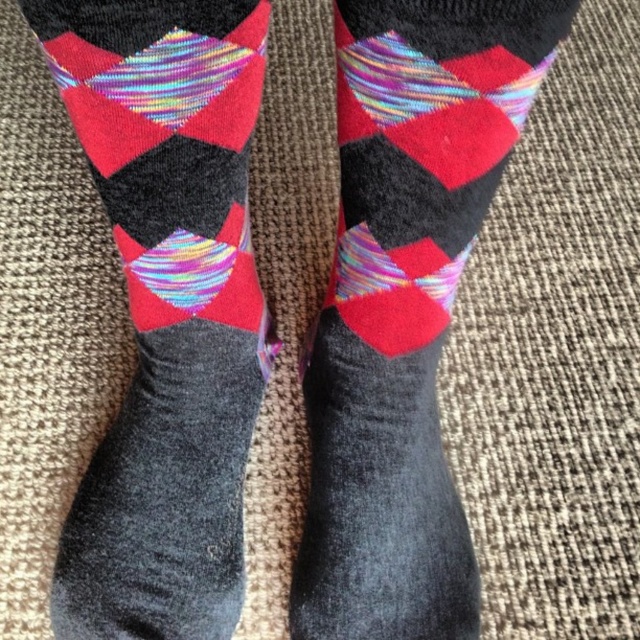
You are a photographer trying to capture the socks in the image. You want to focus on the point that is closer to the camera. Which point should you choose between point (266, 12) and point (433, 129)?

Point (433, 129) is closer to the camera than point (266, 12), so you should choose point (433, 129) to focus on.

You are trying to decide which pair of socks to wear today. You notice both the textured wool socks at center and the holographic fabric socks at center are placed on the carpet. Based on their sizes, which one would you choose if you prefer a larger size?

The textured wool socks at center is larger in size than the holographic fabric socks at center, so you should choose the textured wool socks at center if you prefer a larger size.

You are a photographer trying to capture a detailed closeup of the textured wool socks at center. Your camera has a minimum focusing distance of 60 centimeters. Can you take the photo without moving the socks closer?

The textured wool socks at center is 65.31 centimeters from the camera, which is beyond the camera minimum focusing distance of 60 centimeters. Therefore, you can take the photo without moving the socks closer.